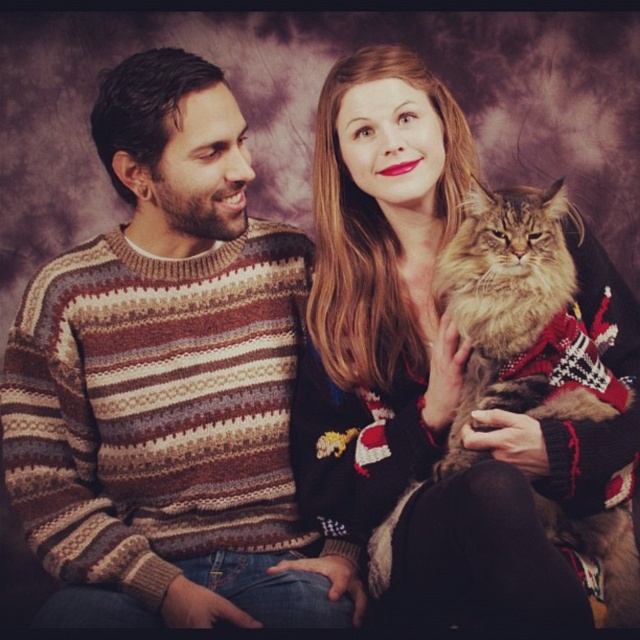
You are a photographer standing 2 meters away from the knitted sweater at left. You want to take a photo of both people in the scene. Will you be able to capture both of them in the frame without moving closer?

The two individuals are 1.17 meters apart. Since you are 2 meters away from the knitted sweater at left, the distance between them is small enough to fit within the frame without needing to move closer.

You are a fashion designer observing two sweaters in the image. The knitted sweater at left and the smooth black sweater at upper right. Which one is placed lower in the image?

The knitted sweater at left is positioned under smooth black sweater at upper right, so the knitted sweater at left is placed lower in the image.